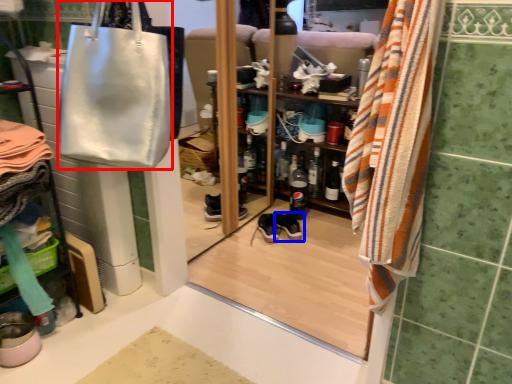
Question: Which point is closer to the camera, handbag (highlighted by a red box) or footwear (highlighted by a blue box)?

Choices:
 (A) handbag
 (B) footwear

Answer: (A)